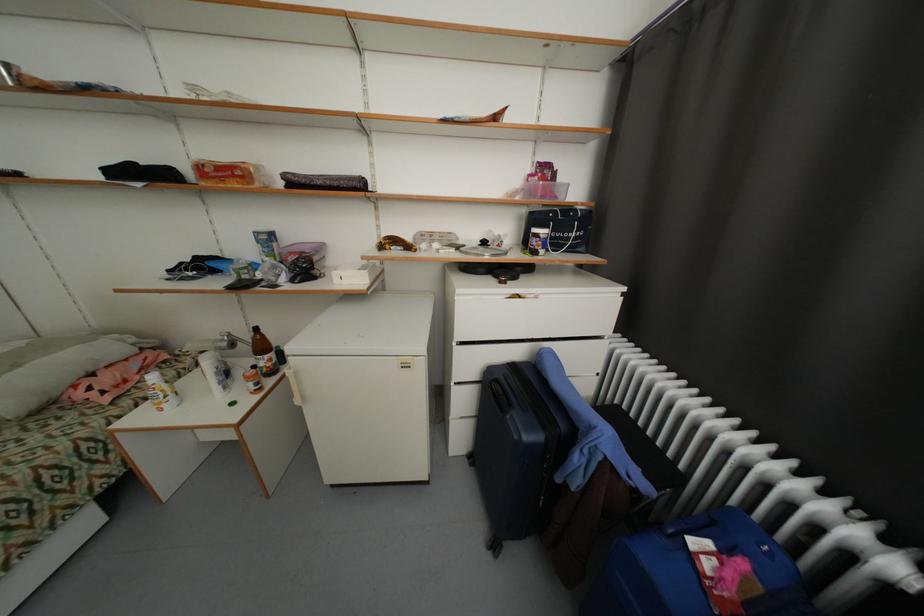
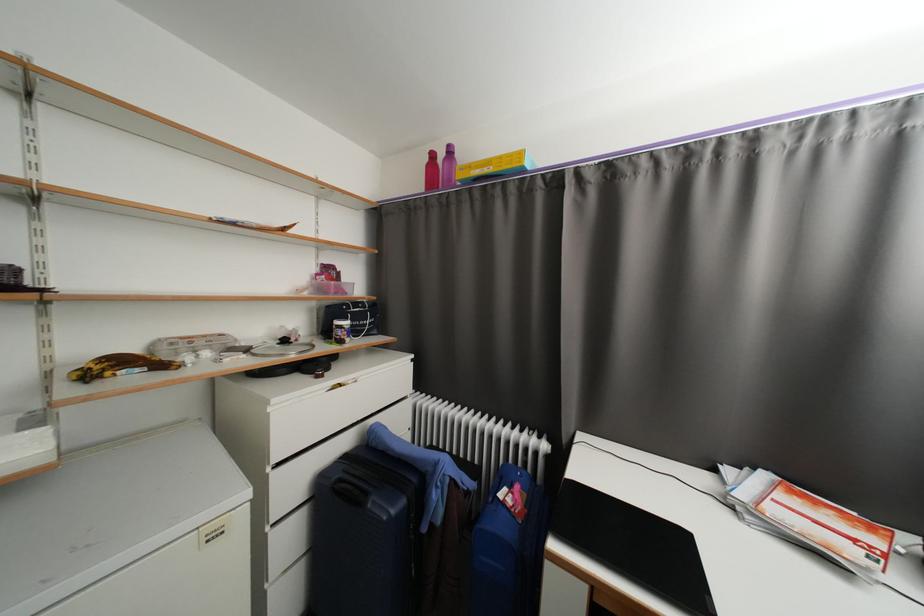
Find the pixel in the second image that matches point (491, 244) in the first image.

(290, 342)